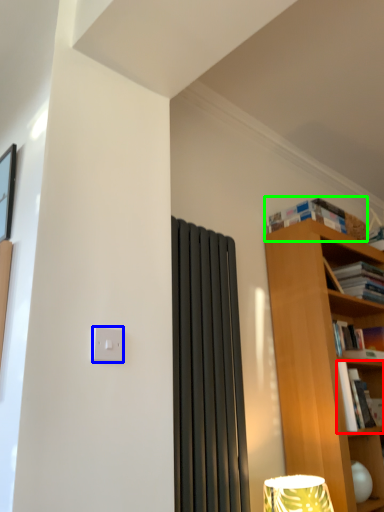
Question: Which object is positioned farthest from book (highlighted by a red box)? Select from light switch (highlighted by a blue box) and book (highlighted by a green box).

Choices:
 (A) light switch
 (B) book

Answer: (A)